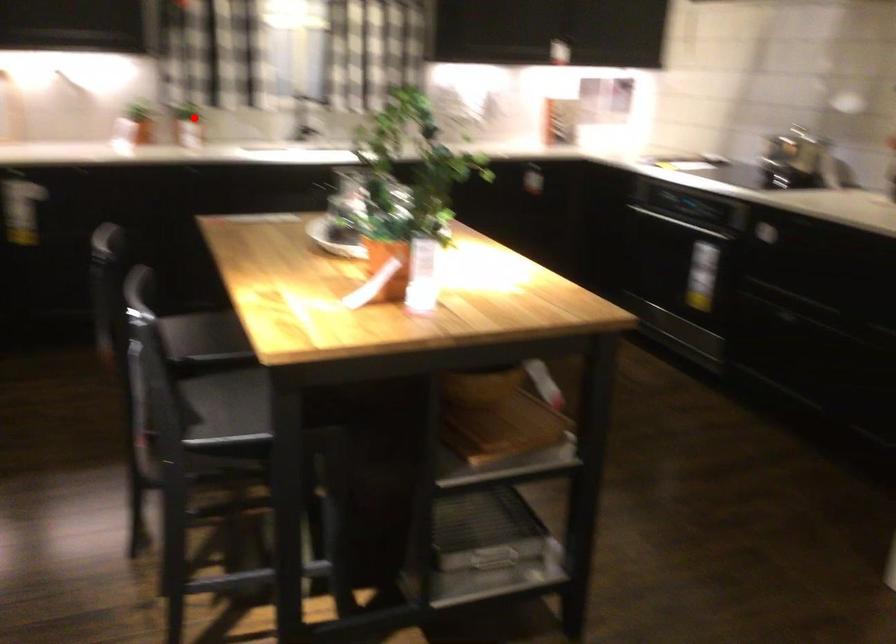
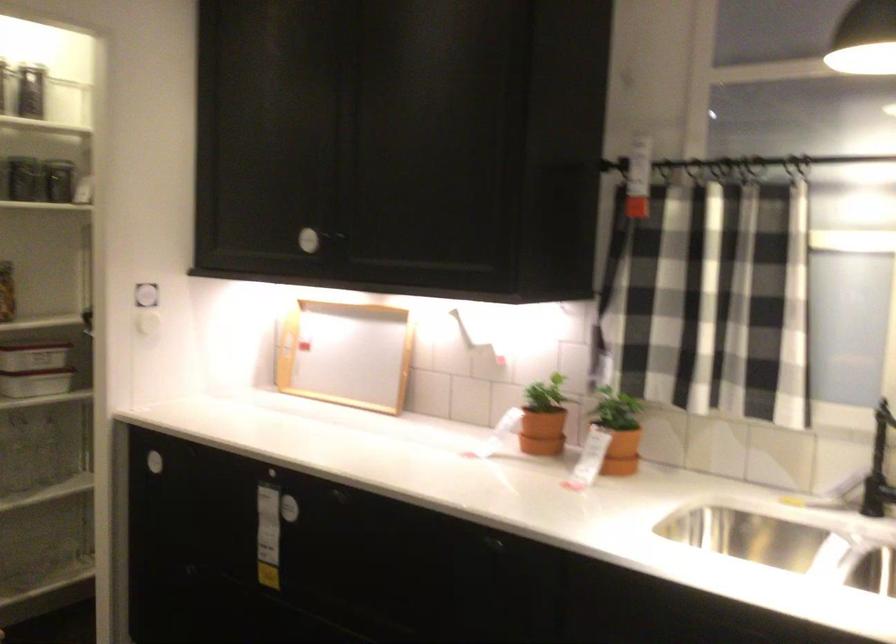
Where in the second image is the point corresponding to the highlighted location from the first image?

(617, 430)